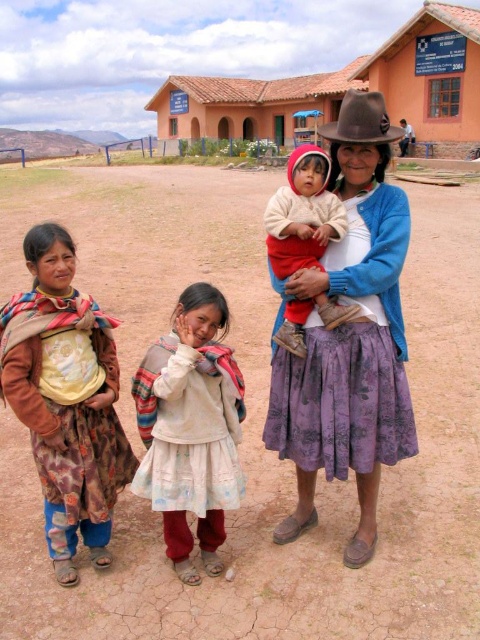
Question: Which object is closer to the camera taking this photo?

Choices:
 (A) floral fabric shawl at left
 (B) brown felt hat at upper center
 (C) purple floral skirt at center

Answer: (A)

Question: Is purple floral skirt at center to the right of floral fabric shawl at left from the viewer's perspective?

Choices:
 (A) no
 (B) yes

Answer: (B)

Question: Is purple floral skirt at center above white soft sweater at center?

Choices:
 (A) no
 (B) yes

Answer: (A)

Question: Which object is the closest to the floral fabric shawl at left?

Choices:
 (A) terracotta clay building at center
 (B) white cotton dress at center

Answer: (B)

Question: Does floral fabric shawl at left appear over white cotton dress at center?

Choices:
 (A) no
 (B) yes

Answer: (B)

Question: Which of the following is the closest to the observer?

Choices:
 (A) (394, 291)
 (B) (324, 321)
 (C) (87, 474)
 (D) (368, 100)

Answer: (D)